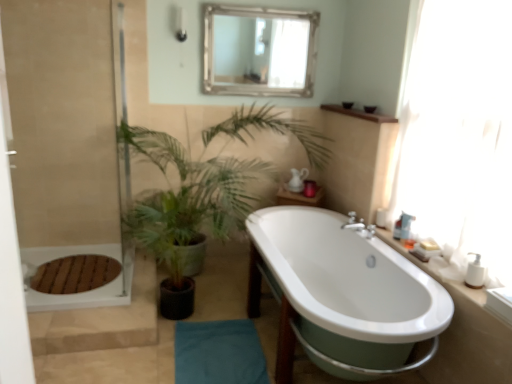
The width and height of the screenshot is (512, 384). I want to click on free space above silver/golden frame mirror at upper center (from a real-world perspective), so click(259, 10).